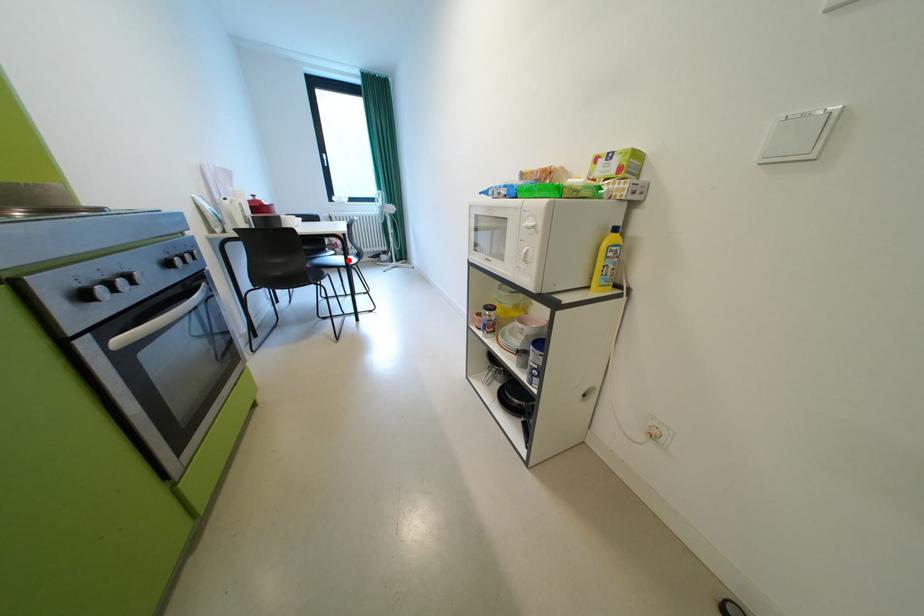
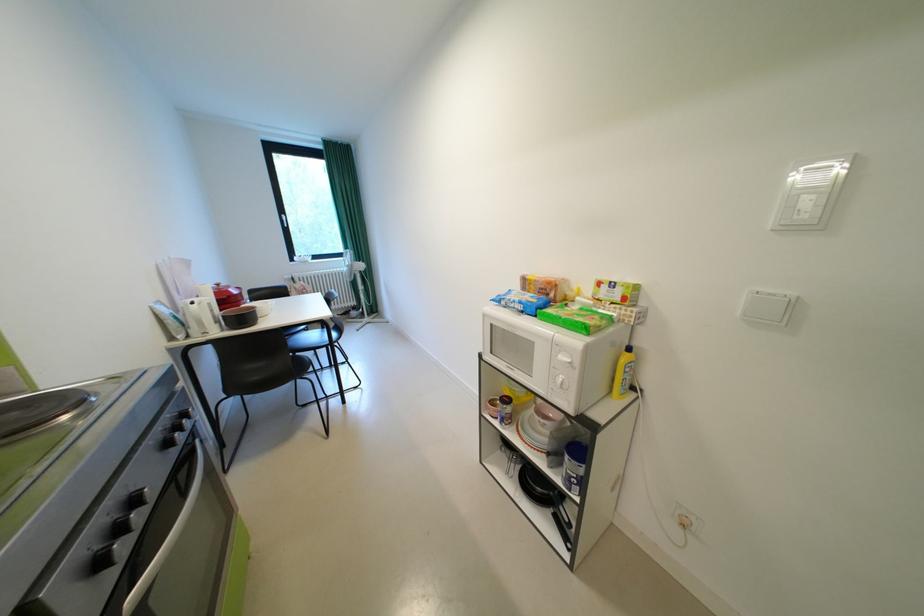
Locate, in the second image, the point that corresponds to the highlighted location in the first image.

(325, 337)